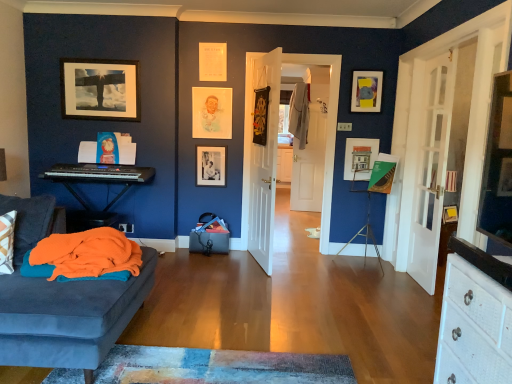
Question: Is matte yellow and gray picture frame at upper right, acting as the first picture frame starting from the right, positioned with its back to black matte picture frame at center, positioned as the second picture frame in left-to-right order?

Choices:
 (A) yes
 (B) no

Answer: (B)

Question: From a real-world perspective, is matte yellow and gray picture frame at upper right, acting as the first picture frame starting from the right, physically above black matte picture frame at center, which ranks as the fourth picture frame in right-to-left order?

Choices:
 (A) yes
 (B) no

Answer: (A)

Question: Is matte yellow and gray picture frame at upper right, marked as the fifth picture frame in a left-to-right arrangement, not inside black matte picture frame at center, positioned as the second picture frame in left-to-right order?

Choices:
 (A) no
 (B) yes

Answer: (B)

Question: Is matte yellow and gray picture frame at upper right, acting as the first picture frame starting from the right, to the right of black matte picture frame at center, positioned as the second picture frame in left-to-right order, from the viewer's perspective?

Choices:
 (A) yes
 (B) no

Answer: (A)

Question: Considering the relative positions of matte yellow and gray picture frame at upper right, acting as the first picture frame starting from the right, and black matte picture frame at center, positioned as the second picture frame in left-to-right order, in the image provided, is matte yellow and gray picture frame at upper right, acting as the first picture frame starting from the right, to the left of black matte picture frame at center, positioned as the second picture frame in left-to-right order, from the viewer's perspective?

Choices:
 (A) yes
 (B) no

Answer: (B)

Question: Looking at the image, does black matte picture frame at center, which ranks as the fourth picture frame in right-to-left order, seem bigger or smaller compared to matte white picture frame at center, the fourth picture frame from the left?

Choices:
 (A) big
 (B) small

Answer: (B)

Question: In the image, is black matte picture frame at center, which ranks as the fourth picture frame in right-to-left order, on the left side or the right side of matte white picture frame at center, which appears as the 2th picture frame when viewed from the right?

Choices:
 (A) right
 (B) left

Answer: (B)

Question: From their relative heights in the image, would you say black matte picture frame at center, which ranks as the fourth picture frame in right-to-left order, is taller or shorter than matte white picture frame at center, which appears as the 2th picture frame when viewed from the right?

Choices:
 (A) tall
 (B) short

Answer: (A)

Question: From the image's perspective, is black matte picture frame at center, which ranks as the fourth picture frame in right-to-left order, positioned above or below matte white picture frame at center, the fourth picture frame from the left?

Choices:
 (A) above
 (B) below

Answer: (B)

Question: Considering the positions of matte white picture frame at center, which appears as the 2th picture frame when viewed from the right, and matte black keyboard at left in the image, is matte white picture frame at center, which appears as the 2th picture frame when viewed from the right, taller or shorter than matte black keyboard at left?

Choices:
 (A) short
 (B) tall

Answer: (A)

Question: Is point (356, 162) positioned closer to the camera than point (102, 180)?

Choices:
 (A) farther
 (B) closer

Answer: (A)

Question: From the image's perspective, is matte white picture frame at center, the fourth picture frame from the left, located above or below matte black keyboard at left?

Choices:
 (A) below
 (B) above

Answer: (B)

Question: Is matte white picture frame at center, which appears as the 2th picture frame when viewed from the right, wider or thinner than matte black keyboard at left?

Choices:
 (A) wide
 (B) thin

Answer: (B)

Question: Would you say white glass door at right, the 1th door from the right, is inside or outside black matte picture frame at center, positioned as the second picture frame in left-to-right order?

Choices:
 (A) outside
 (B) inside

Answer: (A)

Question: From the image's perspective, is white glass door at right, the 1th door from the right, located above or below black matte picture frame at center, positioned as the second picture frame in left-to-right order?

Choices:
 (A) above
 (B) below

Answer: (B)